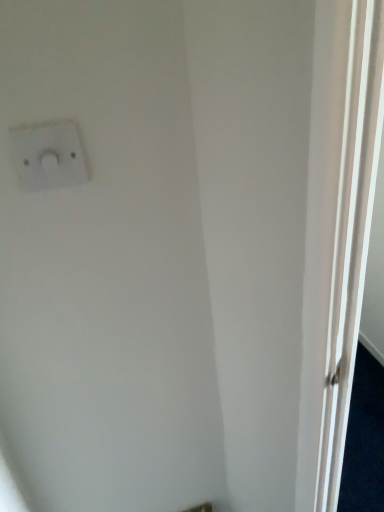
The image size is (384, 512). I want to click on white plastic light switch at upper left, so click(x=49, y=155).

What do you see at coordinates (49, 155) in the screenshot? The height and width of the screenshot is (512, 384). I see `white plastic light switch at upper left` at bounding box center [49, 155].

The width and height of the screenshot is (384, 512). Identify the location of white plastic light switch at upper left. (49, 155).